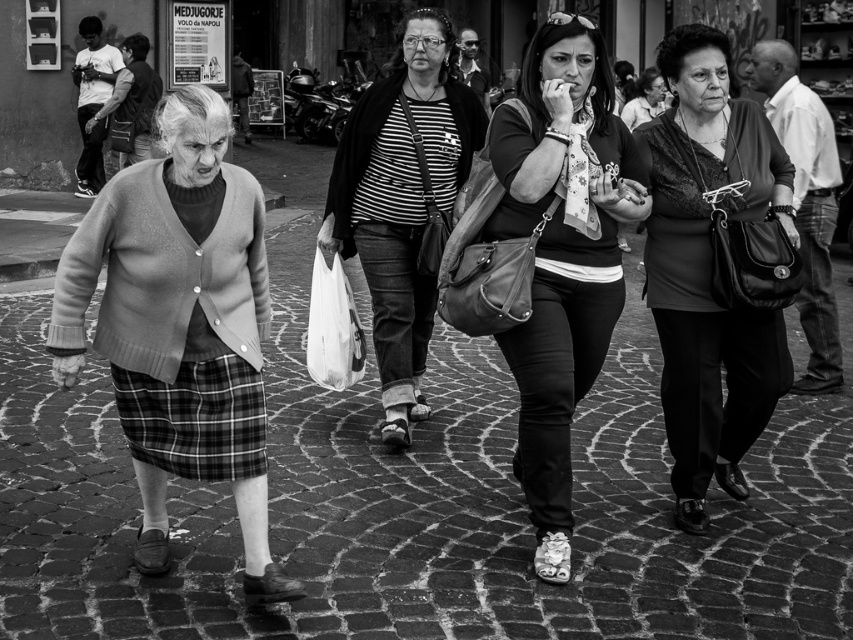
Question: Which point is farther to the camera?

Choices:
 (A) leather handbag at center
 (B) knitted sweater at left
 (C) striped fabric shirt at center
 (D) cobblestone pavement at center

Answer: (D)

Question: Where is cobblestone pavement at center located in relation to striped fabric shirt at center in the image?

Choices:
 (A) left
 (B) right

Answer: (B)

Question: Can you confirm if knitted sweater at left is positioned to the right of striped fabric shirt at center?

Choices:
 (A) no
 (B) yes

Answer: (A)

Question: Is knitted sweater at left smaller than striped fabric shirt at center?

Choices:
 (A) no
 (B) yes

Answer: (B)

Question: Among these objects, which one is nearest to the camera?

Choices:
 (A) knitted sweater at left
 (B) striped fabric shirt at center

Answer: (A)

Question: Based on their relative distances, which object is farther from the cobblestone pavement at center?

Choices:
 (A) knitted sweater at left
 (B) matte black purse at right
 (C) leather handbag at center

Answer: (A)